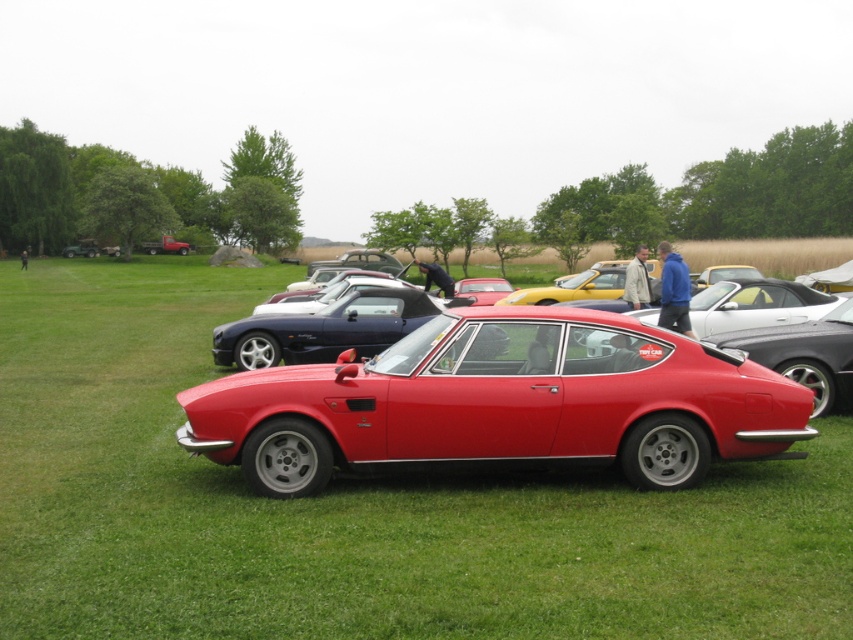
Can you confirm if green grass at center is positioned below glossy red car at center?

Correct, green grass at center is located below glossy red car at center.

Who is more distant from viewer, [825,512] or [459,296]?

The point [459,296] is more distant.

Is point (218, 376) farther from viewer compared to point (489, 285)?

No, (218, 376) is in front of (489, 285).

You are a GUI agent. You are given a task and a screenshot of the screen. Output one action in this format:
    pyautogui.click(x=<x>, y=<y>)
    Task: Click on the green grass at center
    This screenshot has width=853, height=640.
    Given the screenshot: What is the action you would take?
    pyautogui.click(x=354, y=506)

Is matte red sports car at center below glossy red car at center?

Correct, matte red sports car at center is located below glossy red car at center.

Does matte red sports car at center have a smaller size compared to glossy red car at center?

Yes, matte red sports car at center is smaller than glossy red car at center.

Who is more distant from viewer, (321, 436) or (495, 289)?

The point (495, 289) is behind.

Locate an element on the screen. The width and height of the screenshot is (853, 640). matte red sports car at center is located at coordinates (502, 403).

Which is above, green grass at center or matte red sports car at center?

green grass at center

Does green grass at center have a smaller size compared to matte red sports car at center?

No, green grass at center is not smaller than matte red sports car at center.

Where is `green grass at center`? The image size is (853, 640). green grass at center is located at coordinates (354, 506).